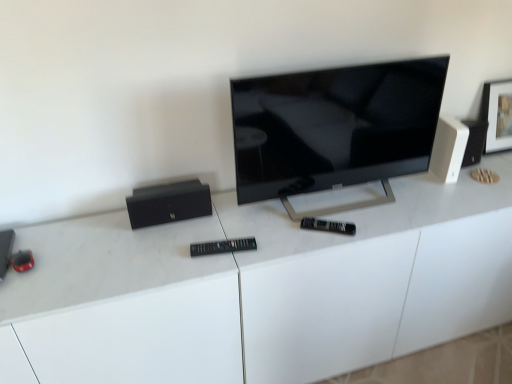
At what (x,y) coordinates should I click in order to perform the action: click on empty space that is to the right of metallic black speaker at left, which is the third speaker in right-to-left order. Please return your answer as a coordinate pair (x, y). The image size is (512, 384). Looking at the image, I should click on (51, 266).